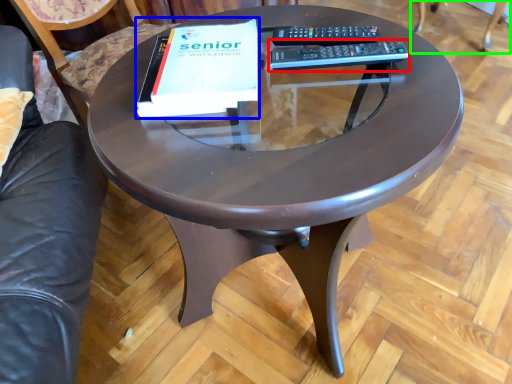
Question: Considering the real-world distances, which object is closest to remote (highlighted by a red box)? paperback book (highlighted by a blue box) or swivel chair (highlighted by a green box).

Choices:
 (A) paperback book
 (B) swivel chair

Answer: (A)